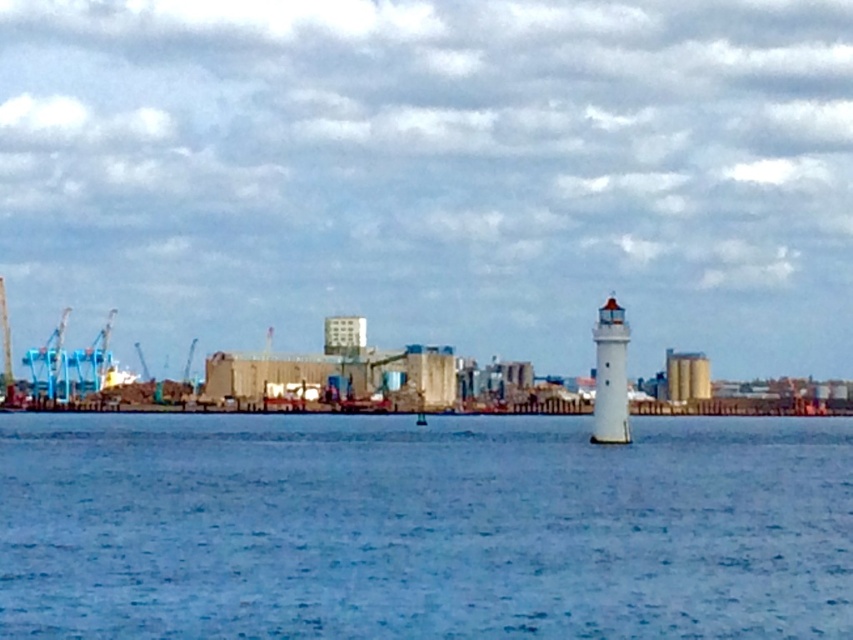
Is white textured lighthouse at right further to camera compared to smooth beige silo at center right?

No, it is in front of smooth beige silo at center right.

I want to click on white textured lighthouse at right, so click(x=610, y=376).

Can you confirm if blue water at center is positioned to the left of smooth concrete silo at center?

No, blue water at center is not to the left of smooth concrete silo at center.

Is point (120, 624) closer to camera compared to point (325, 324)?

Yes, point (120, 624) is closer to viewer.

Find the location of `blue water at center`. blue water at center is located at coordinates (422, 528).

Does blue water at center have a greater height compared to smooth beige silo at center right?

Yes.

Does blue water at center come in front of smooth beige silo at center right?

Yes, blue water at center is in front of smooth beige silo at center right.

In order to click on blue water at center in this screenshot , I will do `click(422, 528)`.